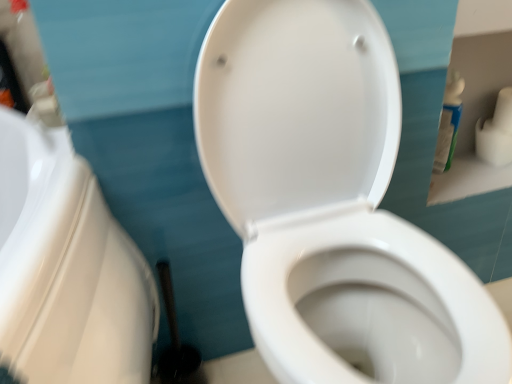
Question: Considering the positions of point (481, 137) and point (419, 236), is point (481, 137) closer or farther from the camera than point (419, 236)?

Choices:
 (A) farther
 (B) closer

Answer: (A)

Question: Which is correct: white matte toilet paper at upper right is inside white glossy toilet at center, or outside of it?

Choices:
 (A) outside
 (B) inside

Answer: (A)

Question: Considering the real-world distances, which object is closest to the white glossy toilet at center?

Choices:
 (A) white plastic bottle at upper right
 (B) white matte toilet paper at upper right

Answer: (A)

Question: Based on their relative distances, which object is farther from the white glossy toilet at center?

Choices:
 (A) white plastic bottle at upper right
 (B) white matte toilet paper at upper right

Answer: (B)